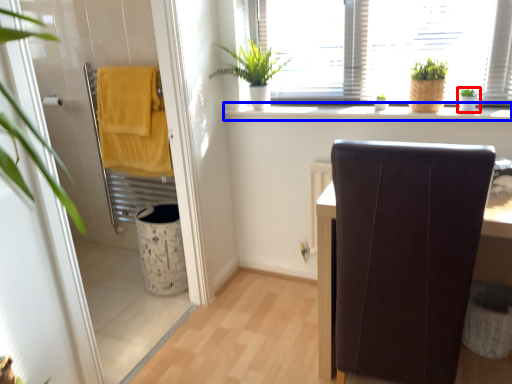
Question: Which point is further to the camera, houseplant (highlighted by a red box) or window sill (highlighted by a blue box)?

Choices:
 (A) houseplant
 (B) window sill

Answer: (A)